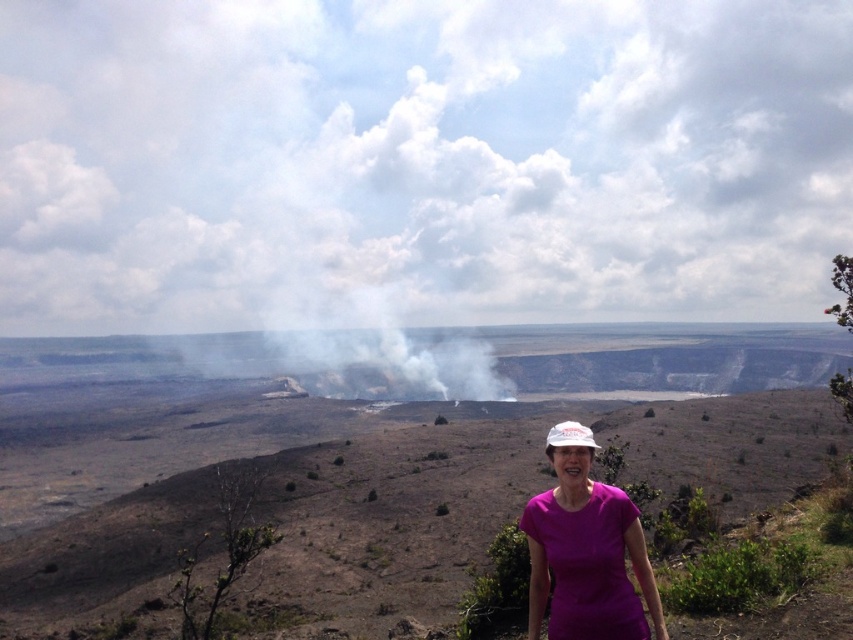
Can you confirm if purple matte shirt at lower center is positioned above white fabric hat at center?

Yes, purple matte shirt at lower center is above white fabric hat at center.

Who is lower down, purple matte shirt at lower center or white fabric hat at center?

white fabric hat at center is lower down.

This screenshot has width=853, height=640. Find the location of `purple matte shirt at lower center`. purple matte shirt at lower center is located at coordinates (587, 556).